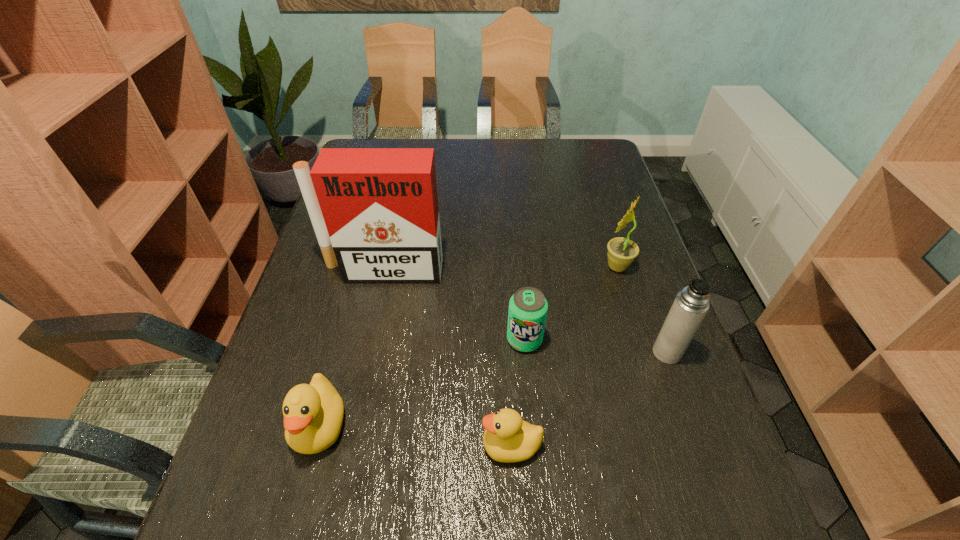
Given the evenly spaced ducks in the image, where should an extra duck be added on the right to preserve the spacing? Please point to a vacant space. Please provide its 2D coordinates. Your answer should be formatted as a tuple, i.e. [(x, y)], where the tuple contains the x and y coordinates of a point satisfying the conditions above.

[(716, 467)]